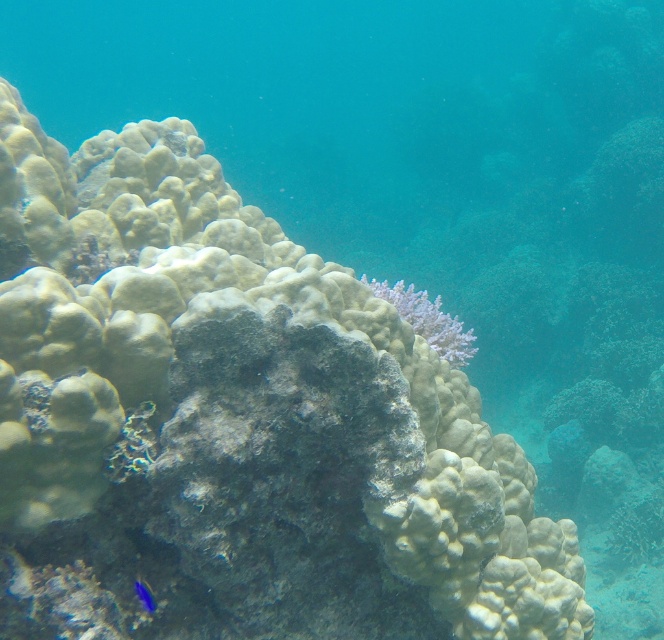
You are a marine biologist observing this underwater scene. You notice the white matte coral at center and the blue glossy fish at lower left. Which object is closer to your diving mask?

The white matte coral at center is closer to your diving mask because it is further to the viewer than the blue glossy fish at lower left.

You are a marine biologist observing this underwater scene. You notice the white matte coral at center and the blue glossy fish at lower left. Which object is taller in this image?

The white matte coral at center is much taller than the blue glossy fish at lower left.